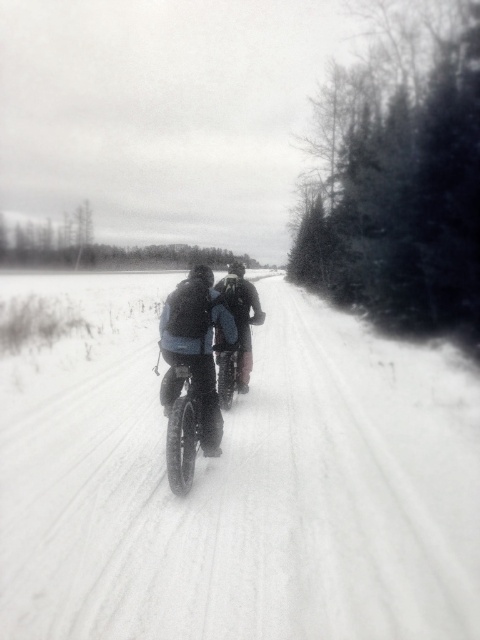
Question: Which point is closer to the camera?

Choices:
 (A) (213, 314)
 (B) (399, 627)
 (C) (172, 468)

Answer: (B)

Question: Is white fluffy snow at center wider than dark blue fabric jacket at center?

Choices:
 (A) no
 (B) yes

Answer: (B)

Question: Which point is closer to the camera?

Choices:
 (A) dark blue fabric jacket at center
 (B) dark gray fabric jacket at center
 (C) white fluffy snow at center

Answer: (C)

Question: Which of the following is the closest to the observer?

Choices:
 (A) (444, 406)
 (B) (247, 284)

Answer: (B)

Question: Is white fluffy snow at center further to the viewer compared to shiny black tire at center?

Choices:
 (A) yes
 (B) no

Answer: (B)

Question: Does white fluffy snow at center have a smaller size compared to shiny black tire at center?

Choices:
 (A) yes
 (B) no

Answer: (B)